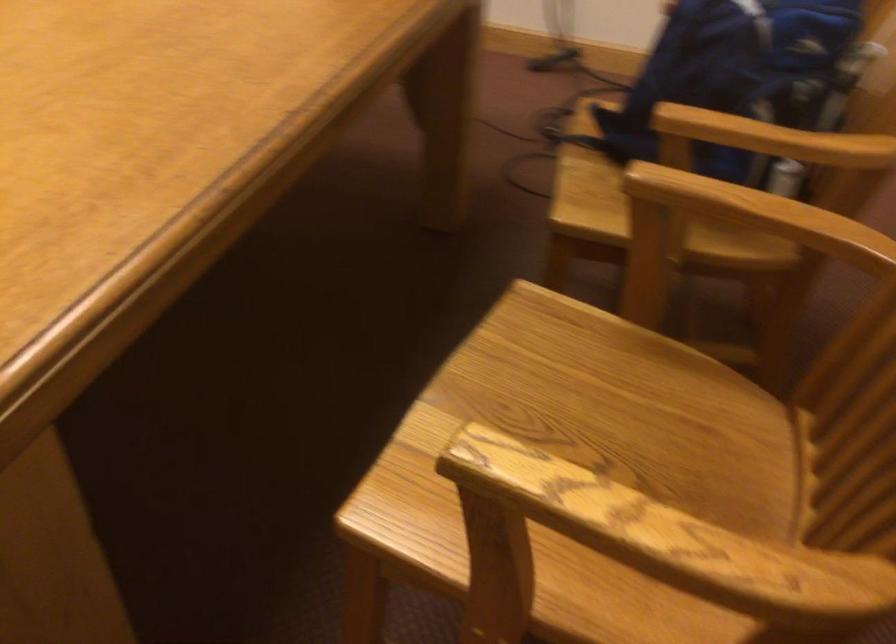
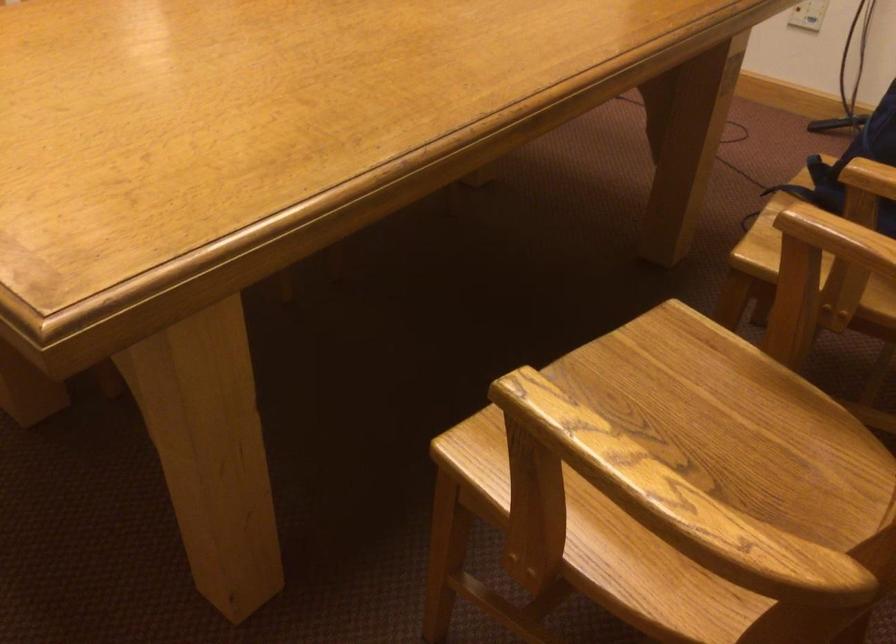
Question: Based on the continuous images, in which direction is the camera rotating? Reply with the corresponding letter.

Choices:
 (A) Left
 (B) Right
 (C) Up
 (D) Down

Answer: (A)